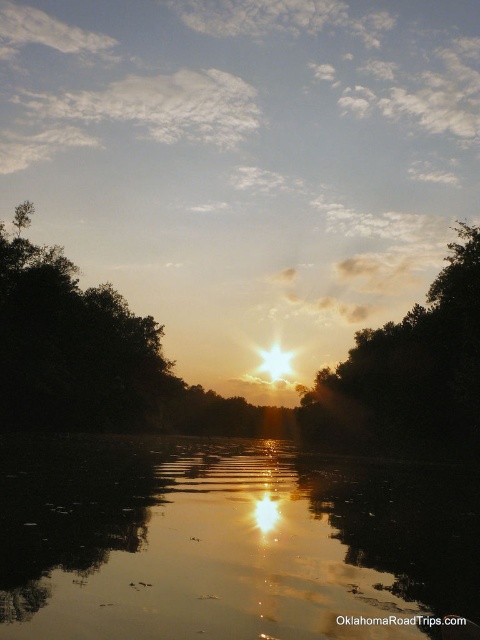
Question: Can you confirm if glistening reflective water at center is positioned to the right of dark green leafy tree at center?

Choices:
 (A) yes
 (B) no

Answer: (B)

Question: Observing the image, what is the correct spatial positioning of glistening reflective water at center in reference to dark green leafy tree at center?

Choices:
 (A) below
 (B) above

Answer: (A)

Question: Which point is closer to the camera?

Choices:
 (A) dark green leafy tree at center
 (B) dark green leafy tree at left
 (C) glistening reflective water at center

Answer: (C)

Question: Estimate the real-world distances between objects in this image. Which object is farther from the dark green leafy tree at center?

Choices:
 (A) glistening reflective water at center
 (B) dark green leafy tree at left

Answer: (B)

Question: Observing the image, what is the correct spatial positioning of glistening reflective water at center in reference to dark green leafy tree at center?

Choices:
 (A) below
 (B) above

Answer: (A)

Question: Among these points, which one is farthest from the camera?

Choices:
 (A) (162, 355)
 (B) (63, 477)

Answer: (A)